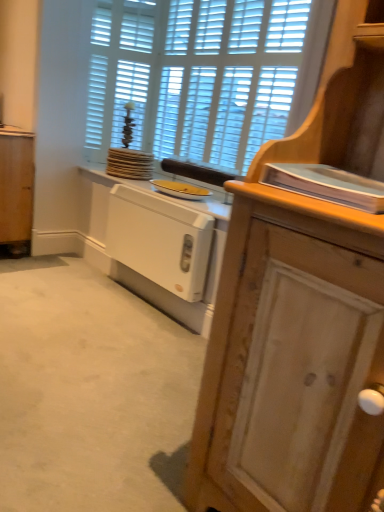
This screenshot has height=512, width=384. I want to click on blank space above wooden cabinet at right (from a real-world perspective), so click(84, 337).